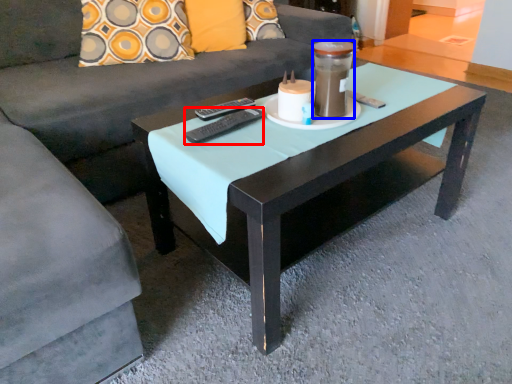
Question: Among these objects, which one is farthest to the camera, remote (highlighted by a red box) or beverage (highlighted by a blue box)?

Choices:
 (A) remote
 (B) beverage

Answer: (A)